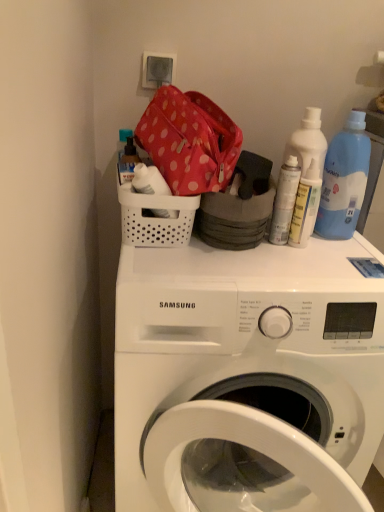
This screenshot has height=512, width=384. Find the location of `free space to the right of white matte spray can at upper right, placed as the second bottle when sorted from right to left`. free space to the right of white matte spray can at upper right, placed as the second bottle when sorted from right to left is located at coordinates (339, 252).